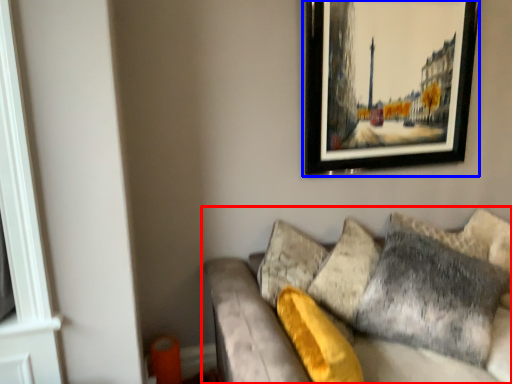
Question: Which object appears farthest to the camera in this image, studio couch (highlighted by a red box) or picture frame (highlighted by a blue box)?

Choices:
 (A) studio couch
 (B) picture frame

Answer: (B)